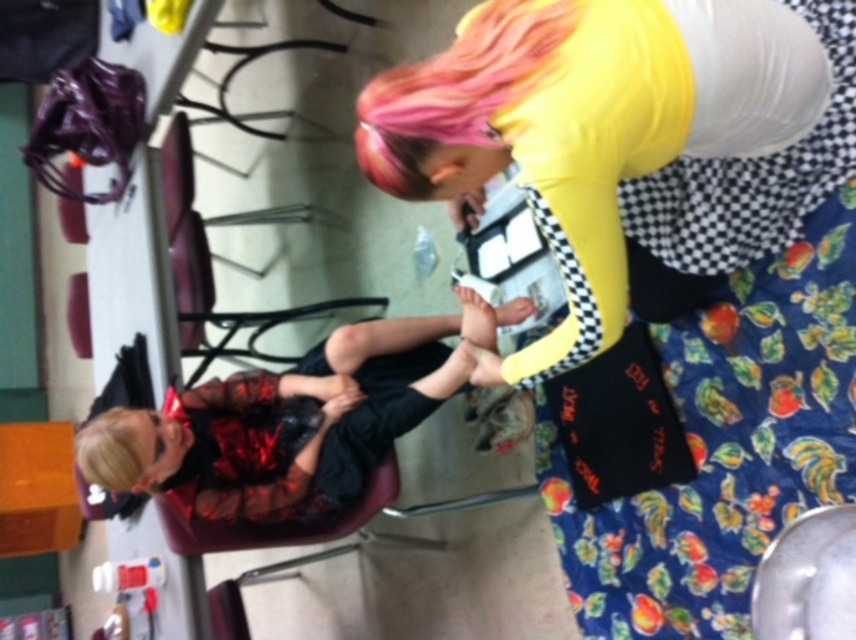
Is point (843, 132) positioned after point (412, 141)?

Yes, it is.

Is matte yellow shirt at upper center bigger than pink dyed hair at upper center?

Indeed, matte yellow shirt at upper center has a larger size compared to pink dyed hair at upper center.

Which is in front, point (617, 273) or point (476, 40)?

Point (476, 40) is more forward.

At what (x,y) coordinates should I click in order to perform the action: click on matte yellow shirt at upper center. Please return your answer as a coordinate pair (x, y). The image size is (856, 640). Looking at the image, I should click on (628, 134).

Who is positioned more to the right, shiny black dress at lower left or pink dyed hair at upper center?

pink dyed hair at upper center is more to the right.

Does shiny black dress at lower left appear under pink dyed hair at upper center?

Indeed, shiny black dress at lower left is positioned under pink dyed hair at upper center.

The image size is (856, 640). Find the location of `shiny black dress at lower left`. shiny black dress at lower left is located at coordinates (293, 419).

Who is more forward, [678,67] or [248,496]?

Point [678,67] is more forward.

The width and height of the screenshot is (856, 640). Describe the element at coordinates (628, 134) in the screenshot. I see `matte yellow shirt at upper center` at that location.

Does point (437, 145) lie in front of point (452, 381)?

That is True.

You are a GUI agent. You are given a task and a screenshot of the screen. Output one action in this format:
    pyautogui.click(x=<x>, y=<y>)
    Task: Click on the matte yellow shirt at upper center
    
    Given the screenshot: What is the action you would take?
    pyautogui.click(x=628, y=134)